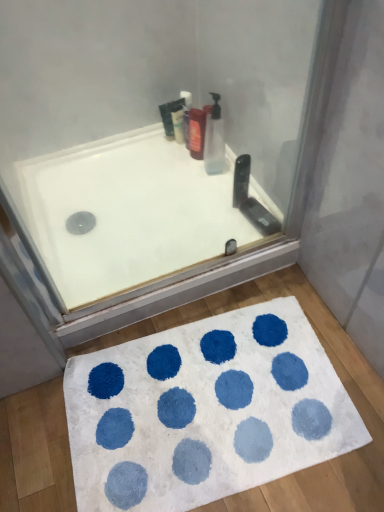
Question: Does shiny plastic soap dispenser at upper center have a smaller size compared to white shaggy bath mat at lower center?

Choices:
 (A) yes
 (B) no

Answer: (A)

Question: Is white shaggy bath mat at lower center at the back of shiny plastic soap dispenser at upper center?

Choices:
 (A) no
 (B) yes

Answer: (A)

Question: Is white shaggy bath mat at lower center a part of shiny plastic soap dispenser at upper center?

Choices:
 (A) no
 (B) yes

Answer: (A)

Question: From a real-world perspective, is shiny plastic soap dispenser at upper center below white shaggy bath mat at lower center?

Choices:
 (A) no
 (B) yes

Answer: (A)

Question: Does shiny plastic soap dispenser at upper center come in front of white shaggy bath mat at lower center?

Choices:
 (A) yes
 (B) no

Answer: (B)

Question: Is translucent plastic bottle at upper center, the second cleaning product in the right-to-left sequence, spatially inside translucent plastic bottle at upper center, which is the 1th cleaning product from front to back, or outside of it?

Choices:
 (A) outside
 (B) inside

Answer: (A)

Question: Considering the positions of translucent plastic bottle at upper center, the second cleaning product in the front-to-back sequence, and translucent plastic bottle at upper center, the first cleaning product viewed from the right, in the image, is translucent plastic bottle at upper center, the second cleaning product in the front-to-back sequence, taller or shorter than translucent plastic bottle at upper center, the first cleaning product viewed from the right,?

Choices:
 (A) short
 (B) tall

Answer: (A)

Question: Is translucent plastic bottle at upper center, the second cleaning product in the front-to-back sequence, in front of or behind translucent plastic bottle at upper center, which appears as the 2th cleaning product when viewed from the back, in the image?

Choices:
 (A) behind
 (B) front

Answer: (A)

Question: Looking at their shapes, would you say translucent plastic bottle at upper center, which appears as the 1th cleaning product when viewed from the left, is wider or thinner than translucent plastic bottle at upper center, which is the 1th cleaning product from front to back?

Choices:
 (A) wide
 (B) thin

Answer: (B)

Question: From a real-world perspective, is shiny plastic soap dispenser at upper center physically located above or below white shaggy bath mat at lower center?

Choices:
 (A) below
 (B) above

Answer: (B)

Question: Considering the positions of shiny plastic soap dispenser at upper center and white shaggy bath mat at lower center in the image, is shiny plastic soap dispenser at upper center bigger or smaller than white shaggy bath mat at lower center?

Choices:
 (A) small
 (B) big

Answer: (A)

Question: Does point (203, 135) appear closer or farther from the camera than point (339, 426)?

Choices:
 (A) farther
 (B) closer

Answer: (A)

Question: Is shiny plastic soap dispenser at upper center in front of or behind white shaggy bath mat at lower center in the image?

Choices:
 (A) behind
 (B) front

Answer: (A)

Question: From the image's perspective, relative to shiny plastic soap dispenser at upper center, is translucent plastic bottle at upper center, the second cleaning product in the front-to-back sequence, above or below?

Choices:
 (A) above
 (B) below

Answer: (A)

Question: Is point (187, 147) positioned closer to the camera than point (200, 145)?

Choices:
 (A) farther
 (B) closer

Answer: (A)